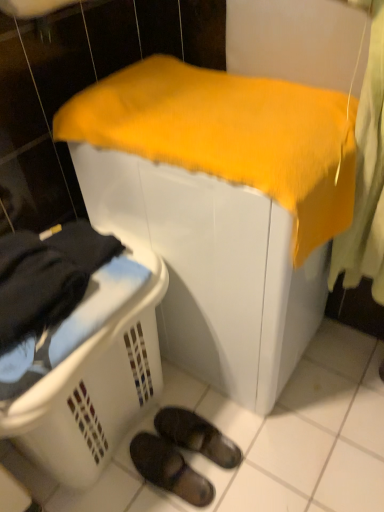
This screenshot has width=384, height=512. What are the coordinates of `free area below black suede slippers at lower center, which is counted as the first footwear, starting from the top (from a real-world perspective)` in the screenshot? It's located at (199, 448).